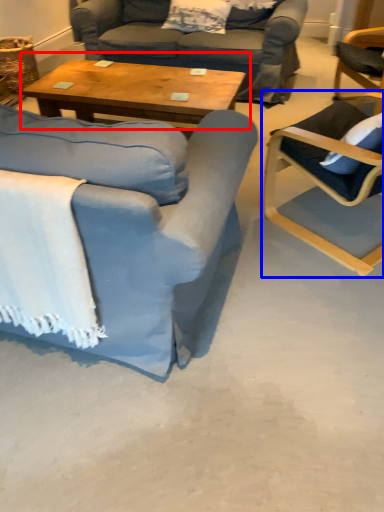
Question: Which of the following is the farthest to the observer, coffee table (highlighted by a red box) or chair (highlighted by a blue box)?

Choices:
 (A) coffee table
 (B) chair

Answer: (A)